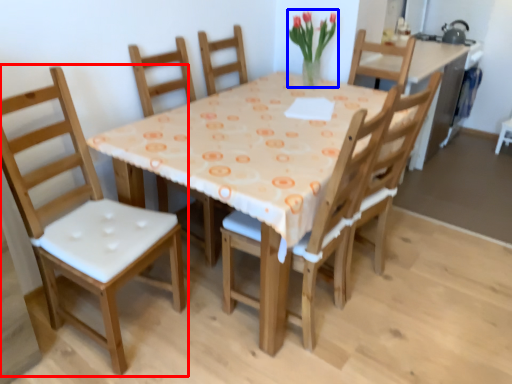
Question: Which point is further to the camera, chair (highlighted by a red box) or floral arrangement (highlighted by a blue box)?

Choices:
 (A) chair
 (B) floral arrangement

Answer: (B)